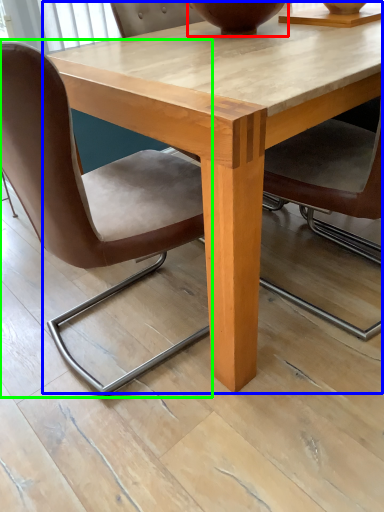
Question: Based on their relative distances, which object is farther from vase (highlighted by a red box)? Choose from coffee table (highlighted by a blue box) and chair (highlighted by a green box).

Choices:
 (A) coffee table
 (B) chair

Answer: (B)